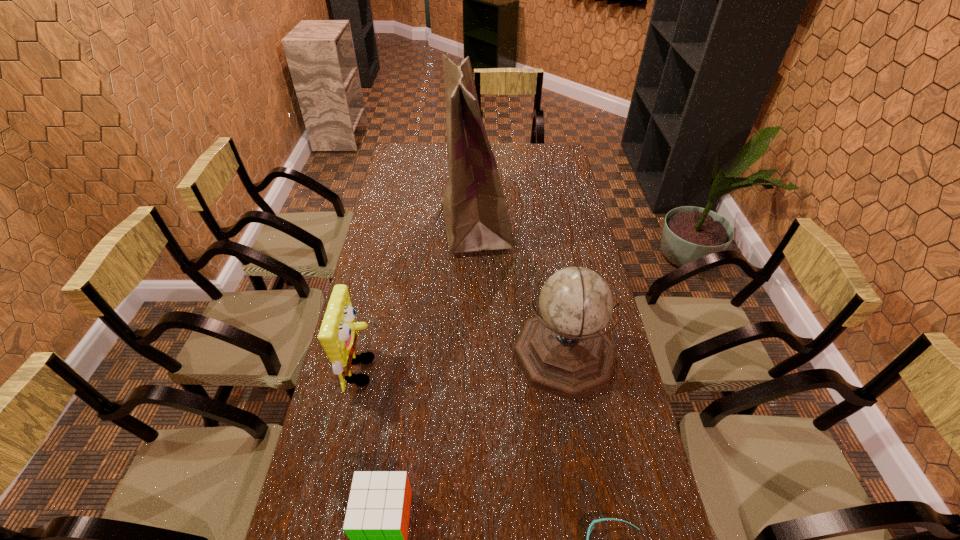
Find the location of `object that is at the left edge`. object that is at the left edge is located at coordinates (338, 336).

At what (x,y) coordinates should I click in order to perform the action: click on object that is at the right edge. Please return your answer as a coordinate pair (x, y). This screenshot has width=960, height=540. Looking at the image, I should click on (564, 351).

Locate an element on the screen. The height and width of the screenshot is (540, 960). blank space at the far edge of the desktop is located at coordinates (500, 167).

Image resolution: width=960 pixels, height=540 pixels. What are the coordinates of `free space at the left edge of the desktop` in the screenshot? It's located at (409, 226).

Where is `free space at the right edge of the desktop`? This screenshot has height=540, width=960. free space at the right edge of the desktop is located at coordinates (555, 184).

Image resolution: width=960 pixels, height=540 pixels. Identify the location of vacant region at the far left corner of the desktop. (425, 157).

At what (x,y) coordinates should I click in order to perform the action: click on vacant space at the far right corner of the desktop. Please return your answer as a coordinate pair (x, y). Image resolution: width=960 pixels, height=540 pixels. Looking at the image, I should click on (544, 149).

Where is `vacant area that lies between the leftmost object and the second tallest object`? vacant area that lies between the leftmost object and the second tallest object is located at coordinates (464, 363).

I want to click on vacant space that's between the leftmost object and the tallest object, so click(x=420, y=297).

Locate which object is the closest to the leftmost object. Please provide its 2D coordinates. Your answer should be formatted as a tuple, i.e. [(x, y)], where the tuple contains the x and y coordinates of a point satisfying the conditions above.

[(377, 517)]